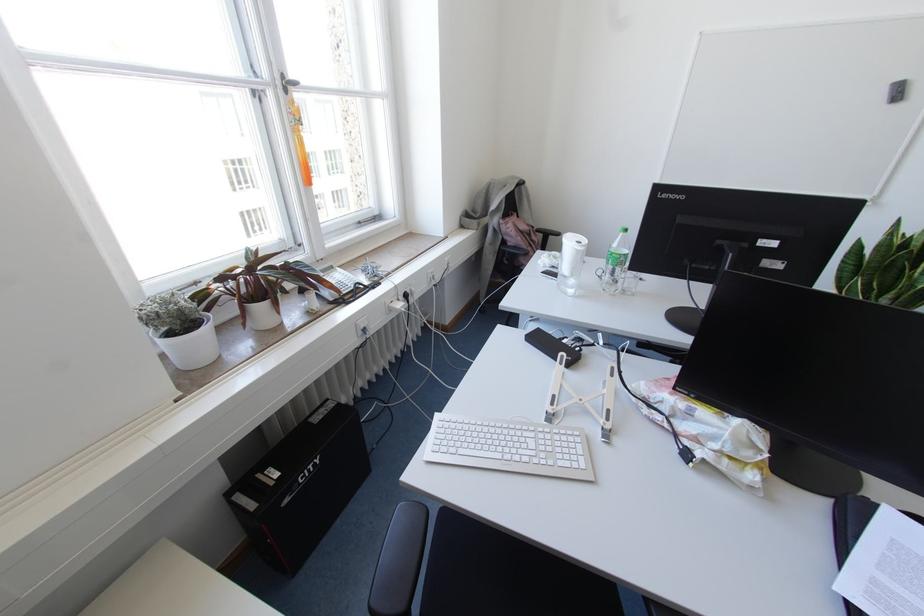
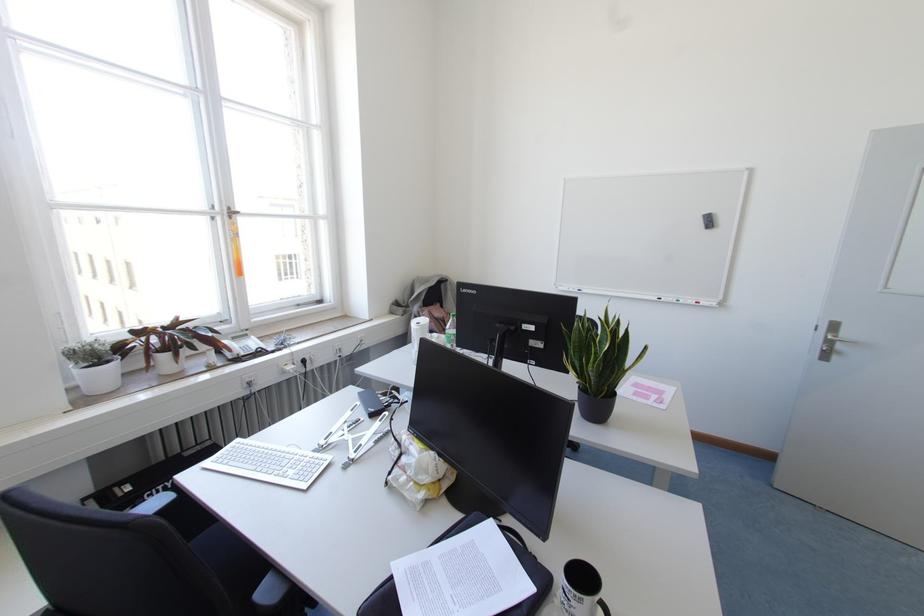
Where in the second image is the point corresponding to the point at 162,342 from the first image?

(75, 371)